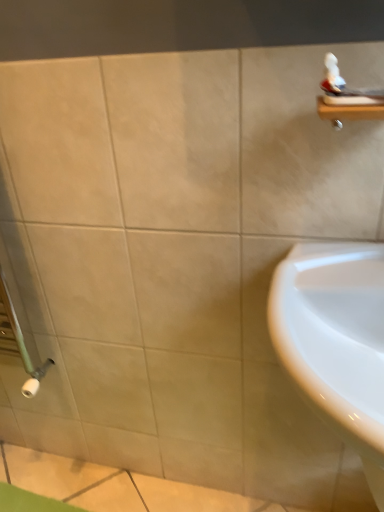
Question: From a real-world perspective, relative to wooden shelf at upper right, is white glossy sink at lower right vertically above or below?

Choices:
 (A) below
 (B) above

Answer: (A)

Question: From the image's perspective, is white glossy sink at lower right above or below wooden shelf at upper right?

Choices:
 (A) above
 (B) below

Answer: (B)

Question: Is white glossy sink at lower right wider or thinner than wooden shelf at upper right?

Choices:
 (A) wide
 (B) thin

Answer: (A)

Question: Is point (331, 117) positioned closer to the camera than point (350, 289)?

Choices:
 (A) farther
 (B) closer

Answer: (B)

Question: Based on their positions, is wooden shelf at upper right located to the left or right of white glossy sink at lower right?

Choices:
 (A) right
 (B) left

Answer: (A)

Question: Considering the positions of wooden shelf at upper right and white glossy sink at lower right in the image, is wooden shelf at upper right taller or shorter than white glossy sink at lower right?

Choices:
 (A) short
 (B) tall

Answer: (A)

Question: Is wooden shelf at upper right wider or thinner than white glossy sink at lower right?

Choices:
 (A) wide
 (B) thin

Answer: (B)